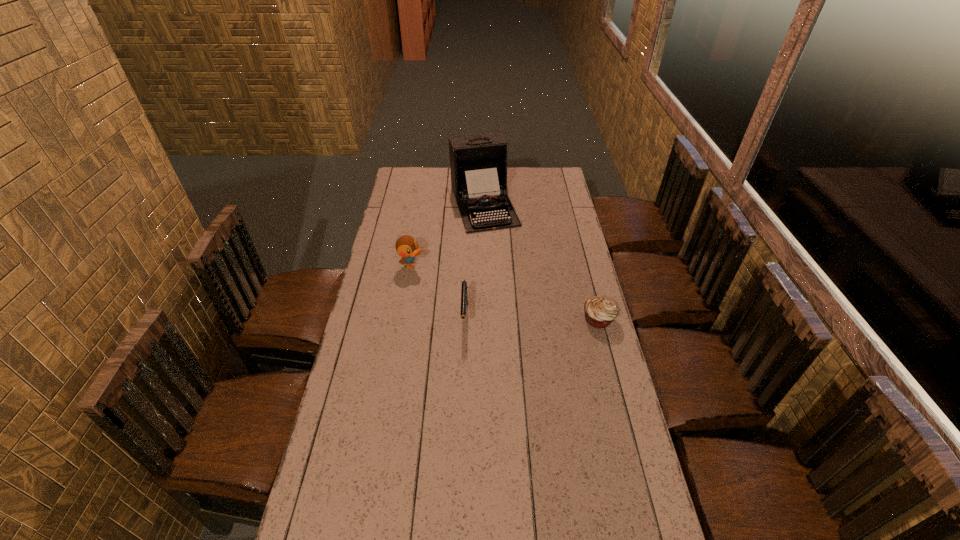
You are a GUI agent. You are given a task and a screenshot of the screen. Output one action in this format:
    pyautogui.click(x=<x>, y=<y>)
    Task: Click on the free space between the rightmost object and the pistol
    The image size is (960, 540).
    Given the screenshot: What is the action you would take?
    pyautogui.click(x=532, y=318)

The image size is (960, 540). I want to click on free point between the duck and the second shortest object, so click(438, 292).

This screenshot has width=960, height=540. I want to click on empty space between the second farthest object and the rightmost object, so click(x=505, y=292).

Where is `empty space between the second tallest object and the tallest object`? The width and height of the screenshot is (960, 540). empty space between the second tallest object and the tallest object is located at coordinates [x=447, y=235].

Locate an element on the screen. The width and height of the screenshot is (960, 540). the second closest object to the tallest object is located at coordinates (464, 297).

Locate which object is the third closest to the farthest object. Please provide its 2D coordinates. Your answer should be formatted as a tuple, i.e. [(x, y)], where the tuple contains the x and y coordinates of a point satisfying the conditions above.

[(600, 311)]

Find the location of a particular element. This screenshot has width=960, height=540. vacant area that satisfies the following two spatial constraints: 1. at the muzzle of the pistol; 2. on the right side of the rightmost object is located at coordinates (465, 319).